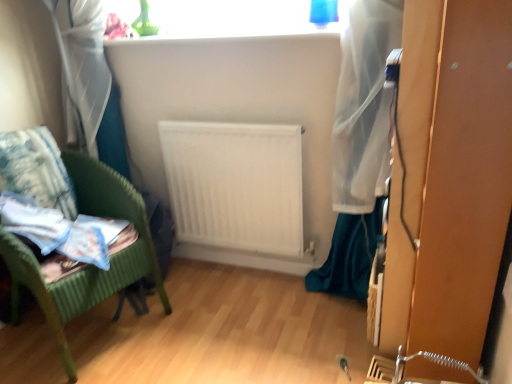
Question: From a real-world perspective, is fluffy white pillow at left over green wicker chair at left?

Choices:
 (A) no
 (B) yes

Answer: (B)

Question: Does fluffy white pillow at left have a lesser width compared to green wicker chair at left?

Choices:
 (A) yes
 (B) no

Answer: (A)

Question: Is fluffy white pillow at left further to camera compared to green wicker chair at left?

Choices:
 (A) no
 (B) yes

Answer: (B)

Question: From the image's perspective, is fluffy white pillow at left above green wicker chair at left?

Choices:
 (A) yes
 (B) no

Answer: (A)

Question: Is fluffy white pillow at left smaller than green wicker chair at left?

Choices:
 (A) no
 (B) yes

Answer: (B)

Question: From a real-world perspective, is fluffy white pillow at left above or below green wicker chair at left?

Choices:
 (A) above
 (B) below

Answer: (A)

Question: Is fluffy white pillow at left wider or thinner than green wicker chair at left?

Choices:
 (A) wide
 (B) thin

Answer: (B)

Question: From the image's perspective, is fluffy white pillow at left positioned above or below green wicker chair at left?

Choices:
 (A) below
 (B) above

Answer: (B)

Question: Considering the positions of fluffy white pillow at left and green wicker chair at left in the image, is fluffy white pillow at left taller or shorter than green wicker chair at left?

Choices:
 (A) tall
 (B) short

Answer: (B)

Question: Do you think white matte radiator at center is within green wicker chair at left, or outside of it?

Choices:
 (A) outside
 (B) inside

Answer: (A)

Question: From the image's perspective, relative to green wicker chair at left, is white matte radiator at center above or below?

Choices:
 (A) below
 (B) above

Answer: (B)

Question: Does point (297, 208) appear closer or farther from the camera than point (53, 284)?

Choices:
 (A) farther
 (B) closer

Answer: (A)

Question: Considering their positions, is white matte radiator at center located in front of or behind green wicker chair at left?

Choices:
 (A) behind
 (B) front

Answer: (A)

Question: In terms of height, does fluffy white pillow at left look taller or shorter compared to white matte radiator at center?

Choices:
 (A) short
 (B) tall

Answer: (A)

Question: From a real-world perspective, is fluffy white pillow at left physically located above or below white matte radiator at center?

Choices:
 (A) above
 (B) below

Answer: (A)